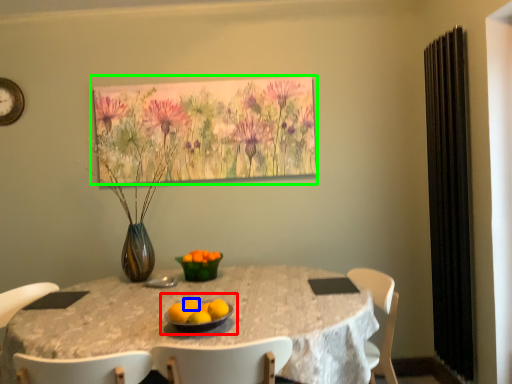
Question: Which object is the closest to the fruit dish (highlighted by a red box)? Choose among these: orange (highlighted by a blue box) or floral arrangement (highlighted by a green box).

Choices:
 (A) orange
 (B) floral arrangement

Answer: (A)